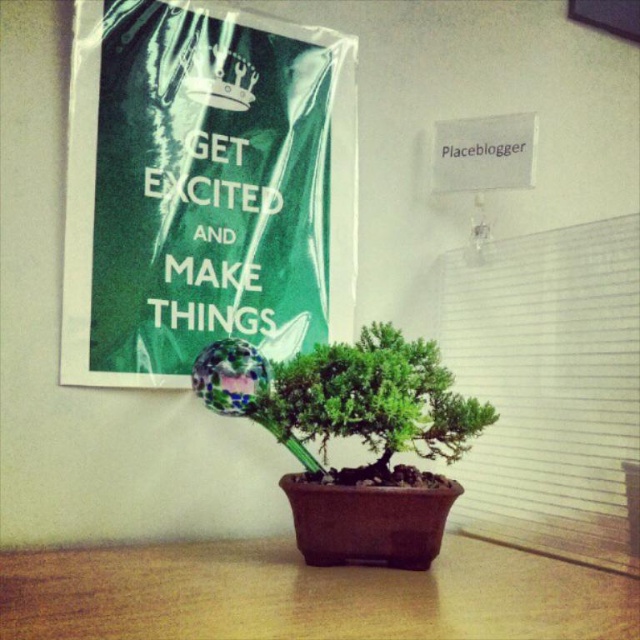
You are a photographer trying to capture the green glossy bonsai tree at center. Since the brown wood table at center is blocking your view, can you move the bonsai tree to the left to get a clear shot? Explain your reasoning based on their positions.

The brown wood table at center is closer to the viewer than the green glossy bonsai tree at center, so moving the bonsai tree to the left might not help because the table is already in front of it. You might need to adjust your angle or move the table instead.